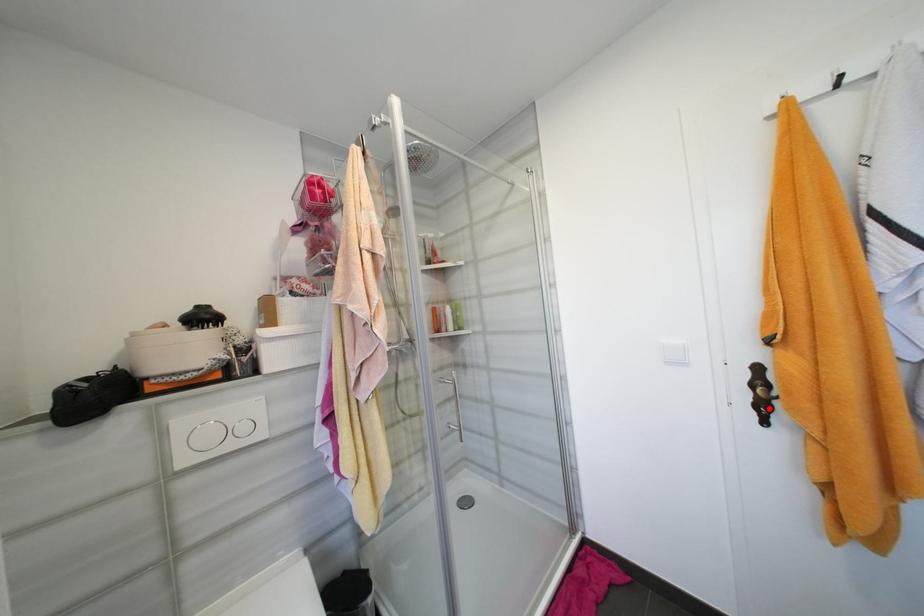
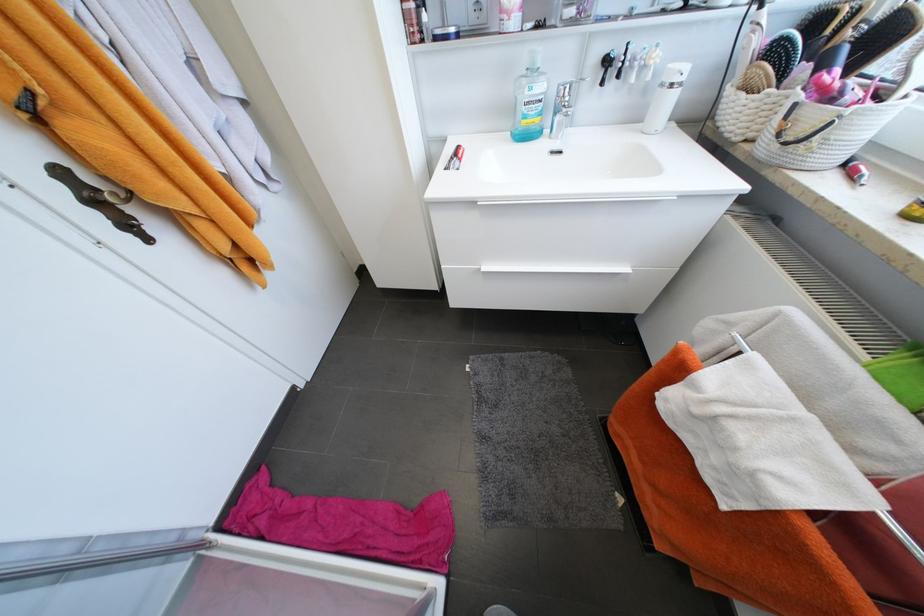
Locate, in the second image, the point that corresponds to the highlighted location in the first image.

(132, 225)